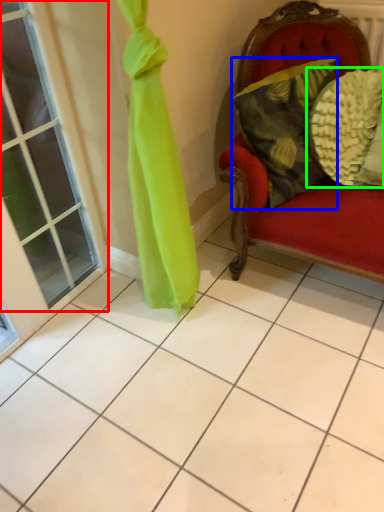
Question: Considering the real-world distances, which object is farthest from window (highlighted by a red box)? pillow (highlighted by a blue box) or pillow (highlighted by a green box)?

Choices:
 (A) pillow
 (B) pillow

Answer: (B)